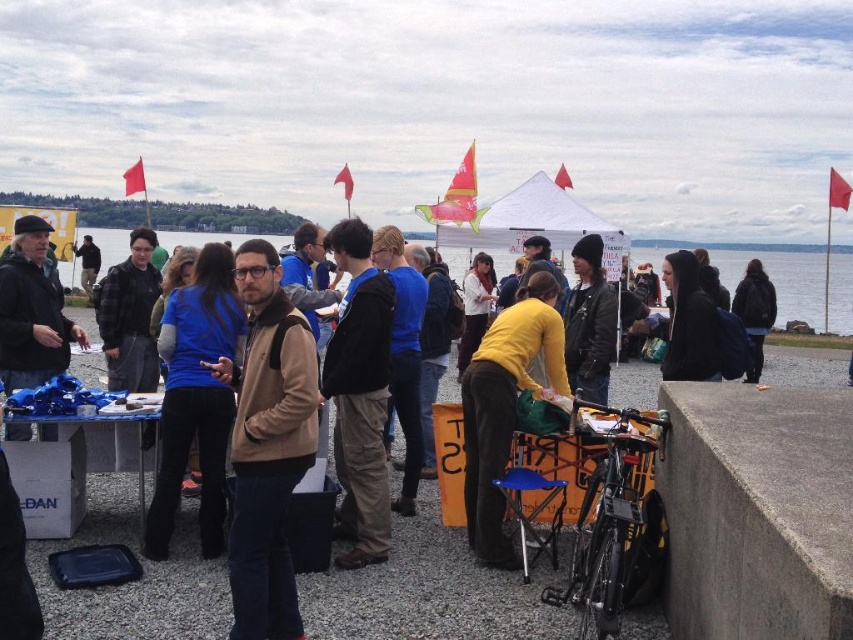
You are standing at the waterfront event and want to reach the point marked at coordinates (477, 458). If you can walk 20 feet per minute, how long will it take you to reach that point?

The point at coordinates (477, 458) is 17.20 feet away from the viewer. At a walking speed of 20 feet per minute, it would take approximately 0.86 minutes, which is about 52 seconds, to reach the point.

You are organizing a photo shoot and need to ensure that the yellow matte shirt at center and the black leather jacket at right are both visible in the frame. Given their sizes, which one might require more careful positioning to avoid being cropped out?

The black leather jacket at right requires more careful positioning because it occupies more space than the yellow matte shirt at center, making it more prone to being cropped out if not framed properly.